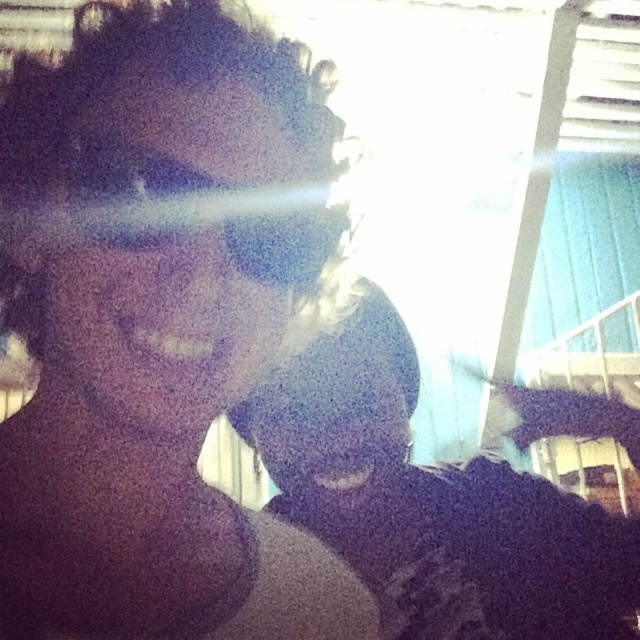
Is matte black hair at upper left above matte black goggles at center?

No.

Between matte black hair at upper left and matte black goggles at center, which one has less height?

matte black goggles at center

This screenshot has height=640, width=640. In order to click on matte black hair at upper left in this screenshot , I will do `click(157, 333)`.

The height and width of the screenshot is (640, 640). Identify the location of matte black hair at upper left. (157, 333).

Looking at this image, can you confirm if dark fabric at center is bigger than matte black goggles at center?

Indeed, dark fabric at center has a larger size compared to matte black goggles at center.

Which is behind, point (276, 458) or point (196, 216)?

Point (276, 458)

Which is behind, point (524, 404) or point (307, 234)?

The point (524, 404) is behind.

Identify the location of dark fabric at center. The width and height of the screenshot is (640, 640). (432, 502).

Which of these two, matte black hair at upper left or dark fabric at center, stands shorter?

matte black hair at upper left

The height and width of the screenshot is (640, 640). What are the coordinates of `matte black hair at upper left` in the screenshot? It's located at (157, 333).